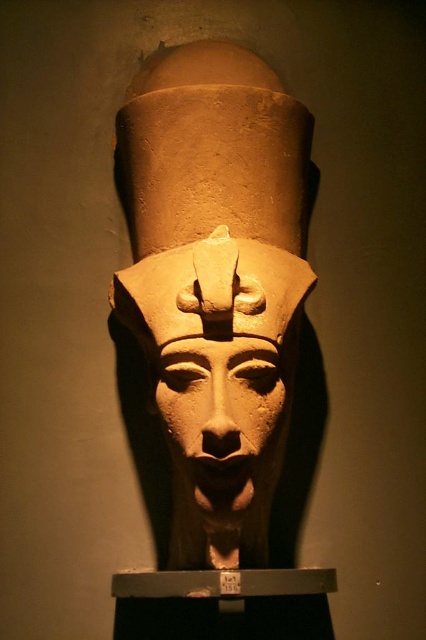
Question: Is matte clay head at center further to the viewer compared to matte stone face at center?

Choices:
 (A) no
 (B) yes

Answer: (B)

Question: Can you confirm if matte clay head at center is positioned above matte stone face at center?

Choices:
 (A) yes
 (B) no

Answer: (A)

Question: Which point is farther from the camera taking this photo?

Choices:
 (A) (192, 138)
 (B) (273, 401)

Answer: (A)

Question: Can you confirm if matte clay head at center is bigger than matte stone face at center?

Choices:
 (A) yes
 (B) no

Answer: (A)

Question: Which point appears farthest from the camera in this image?

Choices:
 (A) (160, 397)
 (B) (189, 109)

Answer: (B)